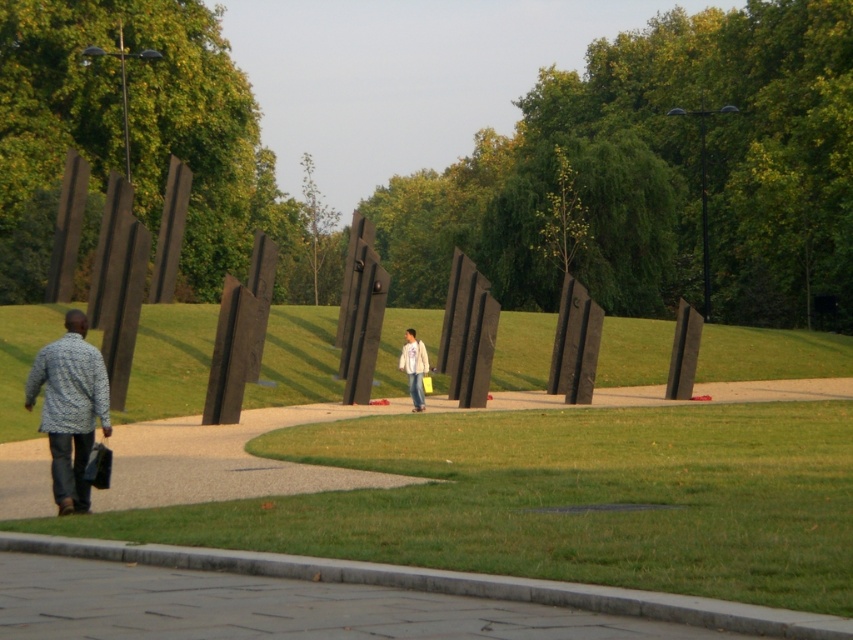
Is green leafy tree at center bigger than white cotton jacket at center?

Yes.

Between green leafy tree at center and white cotton jacket at center, which one appears on the right side from the viewer's perspective?

From the viewer's perspective, green leafy tree at center appears more on the right side.

Between point (779, 3) and point (410, 340), which one is positioned behind?

Point (779, 3)

Where is `green leafy tree at center`? The height and width of the screenshot is (640, 853). green leafy tree at center is located at coordinates (660, 173).

I want to click on green leafy tree at center, so click(x=660, y=173).

Is green leafy tree at center to the left of dark brown wood at left from the viewer's perspective?

In fact, green leafy tree at center is to the right of dark brown wood at left.

This screenshot has width=853, height=640. I want to click on green leafy tree at center, so click(660, 173).

Identify the location of green leafy tree at center. (660, 173).

From the picture: Does green leafy tree at center have a lesser height compared to patterned fabric shirt at lower left?

Incorrect, green leafy tree at center's height does not fall short of patterned fabric shirt at lower left's.

Measure the distance from green leafy tree at center to patterned fabric shirt at lower left.

168.06 feet

Where is `green leafy tree at center`? Image resolution: width=853 pixels, height=640 pixels. green leafy tree at center is located at coordinates (660, 173).